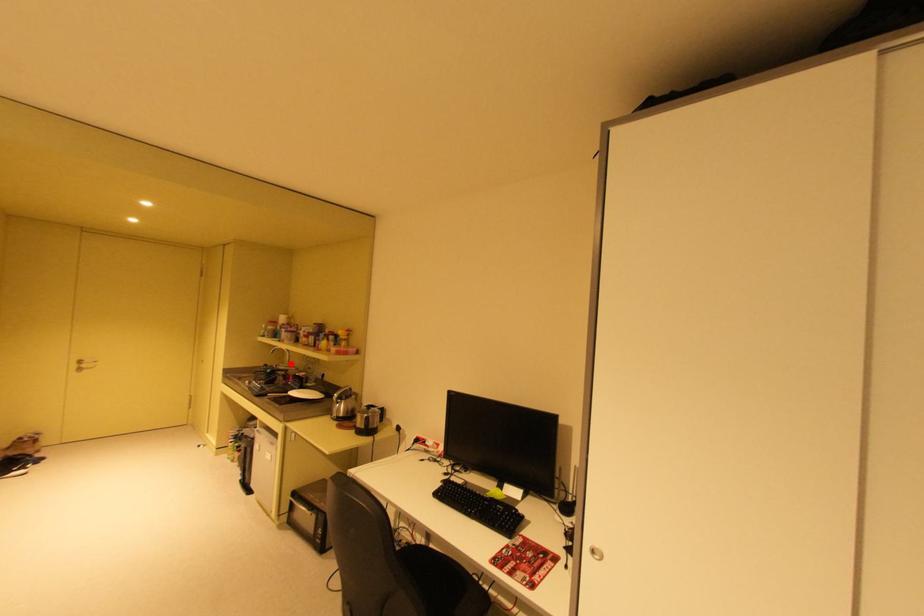
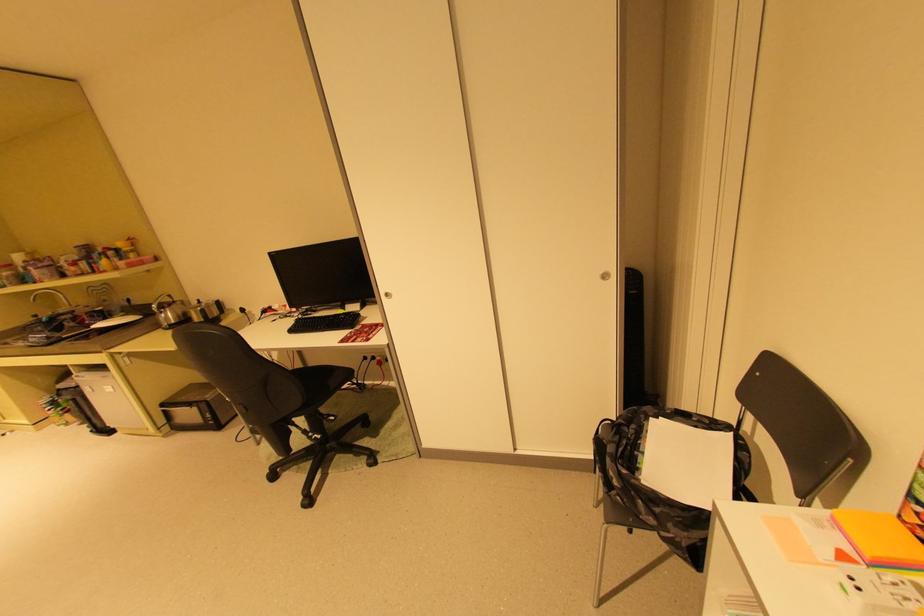
Find the pixel in the second image that matches the highlighted location in the first image.

(69, 308)